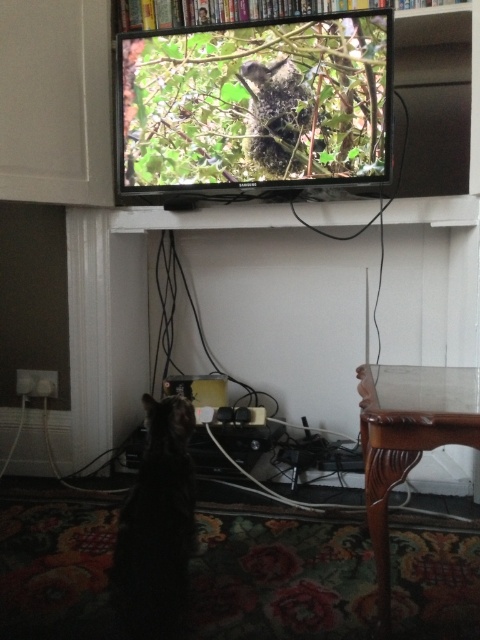
Question: Can you confirm if mahogany wood table at lower right is positioned above black fur cat at lower left?

Choices:
 (A) no
 (B) yes

Answer: (B)

Question: Which object is closer to the camera taking this photo?

Choices:
 (A) mahogany wood table at lower right
 (B) wooden bookshelf at upper center

Answer: (A)

Question: Considering the relative positions of black fur cat at lower left and wooden bookshelf at upper center in the image provided, where is black fur cat at lower left located with respect to wooden bookshelf at upper center?

Choices:
 (A) right
 (B) left

Answer: (B)

Question: Does black fur cat at lower left appear over wooden bookshelf at upper center?

Choices:
 (A) no
 (B) yes

Answer: (A)

Question: Which point is closer to the camera?

Choices:
 (A) wooden bookshelf at upper center
 (B) mahogany wood table at lower right
 (C) black fur cat at lower left

Answer: (B)

Question: Which object is closer to the camera taking this photo?

Choices:
 (A) mahogany wood table at lower right
 (B) wooden bookshelf at upper center
 (C) black fur cat at lower left

Answer: (A)